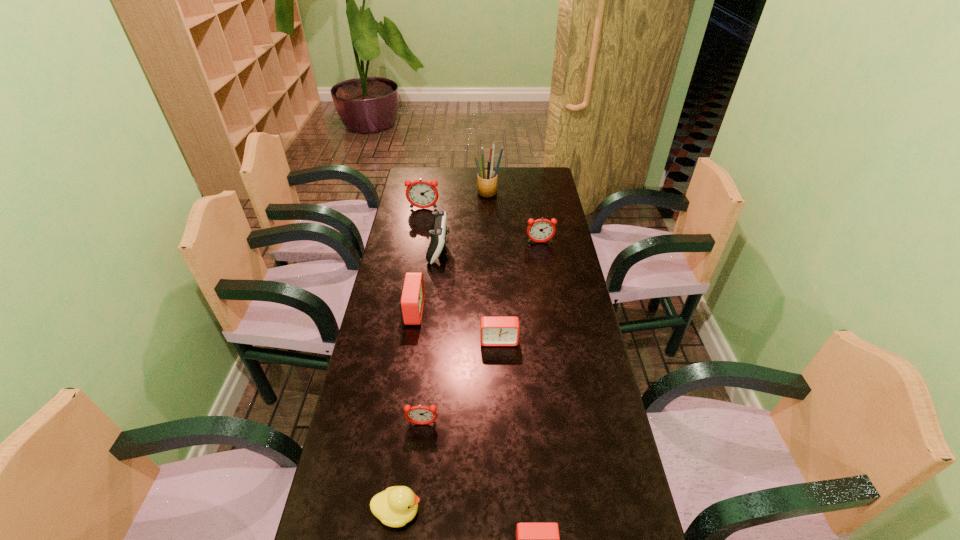
The width and height of the screenshot is (960, 540). I want to click on the second smallest red alarm clock, so click(494, 330).

Locate an element on the screen. The image size is (960, 540). the second nearest red alarm clock is located at coordinates (494, 330).

You are a GUI agent. You are given a task and a screenshot of the screen. Output one action in this format:
    pyautogui.click(x=<x>, y=<y>)
    Task: Click on the seventh farthest object
    
    Given the screenshot: What is the action you would take?
    pyautogui.click(x=422, y=415)

Locate an element on the screen. the smallest reddish-pink alarm clock is located at coordinates (422, 415).

At what (x,y) coordinates should I click in order to perform the action: click on blank space located 0.280m on the left of the brown pencil box. Please return your answer as a coordinate pair (x, y). Looking at the image, I should click on (416, 193).

You are a GUI agent. You are given a task and a screenshot of the screen. Output one action in this format:
    pyautogui.click(x=<x>, y=<y>)
    Task: Click on the vacant space located 0.240m on the front-facing side of the eighth nearest object
    The width and height of the screenshot is (960, 540).
    Given the screenshot: What is the action you would take?
    pyautogui.click(x=418, y=244)

In order to click on vacant space located 0.360m on the front-facing side of the control in this screenshot , I will do `click(540, 249)`.

Image resolution: width=960 pixels, height=540 pixels. I want to click on free point located on the front-facing side of the rightmost reddish-pink alarm clock, so click(x=541, y=252).

Where is `vacant space located on the front-facing side of the fourth nearest alarm clock`? This screenshot has height=540, width=960. vacant space located on the front-facing side of the fourth nearest alarm clock is located at coordinates (532, 311).

Find the location of a particular element. free space located on the beak of the yellow duckling is located at coordinates (452, 511).